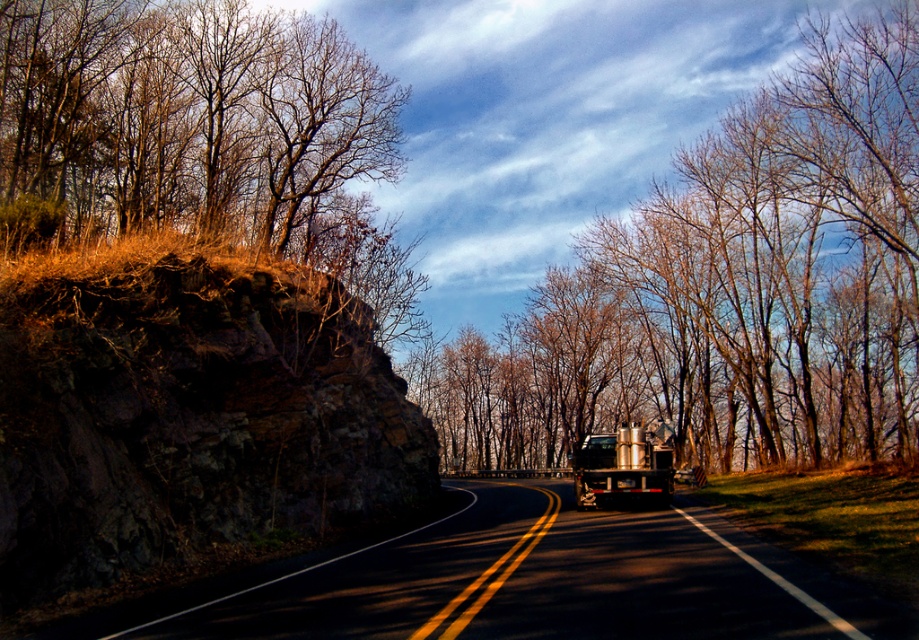
Question: Observing the image, what is the correct spatial positioning of bare branches at center in reference to black asphalt road at center?

Choices:
 (A) above
 (B) below

Answer: (A)

Question: Which point is farther to the camera?

Choices:
 (A) metallic silver trailer truck at center-right
 (B) rocky cliff at left
 (C) black asphalt road at center

Answer: (A)

Question: Which object is the closest to the metallic silver trailer truck at center-right?

Choices:
 (A) bare branches at center
 (B) rocky cliff at left

Answer: (B)

Question: Can you confirm if rocky cliff at left is positioned above metallic silver trailer truck at center-right?

Choices:
 (A) yes
 (B) no

Answer: (A)

Question: Can you confirm if bare branches at center is smaller than black asphalt road at center?

Choices:
 (A) no
 (B) yes

Answer: (A)

Question: Which object is the farthest from the black asphalt road at center?

Choices:
 (A) metallic silver trailer truck at center-right
 (B) bare branches at center
 (C) rocky cliff at left

Answer: (B)